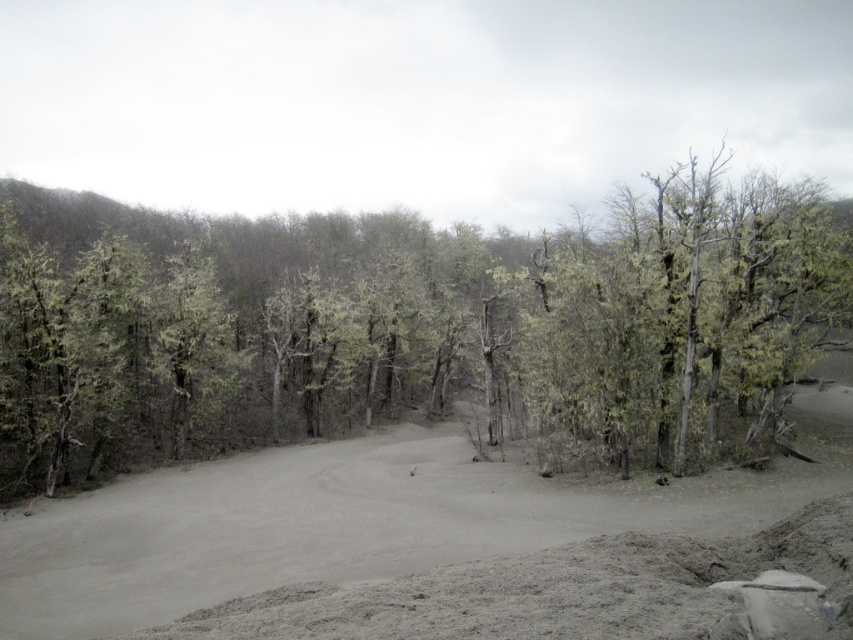
You are a hiker trying to navigate through the desolate landscape. You notice the green mossy tree at center and the gray sandy dirt track at center. Which of these two landmarks is bigger in size?

The green mossy tree at center is larger in size than the gray sandy dirt track at center, so the green mossy tree at center is bigger in size.

You are a hiker trying to follow the gray sandy dirt track at center through the desolate landscape. However, you notice the green mossy tree at center blocking your path. Can you walk around the tree without leaving the track?

The green mossy tree at center is positioned over gray sandy dirt track at center, meaning the tree is directly on top of the track. Therefore, you cannot walk around the tree without leaving the track since the tree is blocking the entire path.

You are standing in the middle of the sandy landscape and see two points marked in the image. Which point is closer to you, point [466,372] or point [735,566]?

Point [735,566] is closer to you because it is less further to the camera than point [466,372].